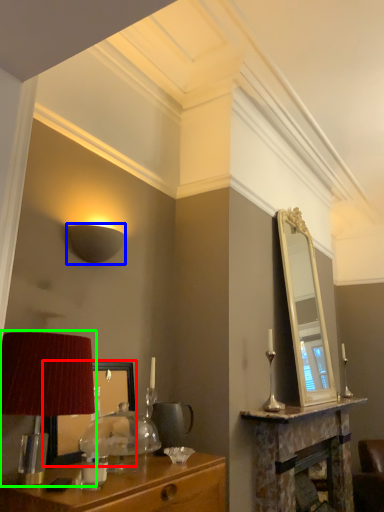
Question: Which object is the closest to the mirror (highlighted by a red box)? Choose among these: lamp (highlighted by a blue box) or table lamp (highlighted by a green box).

Choices:
 (A) lamp
 (B) table lamp

Answer: (B)